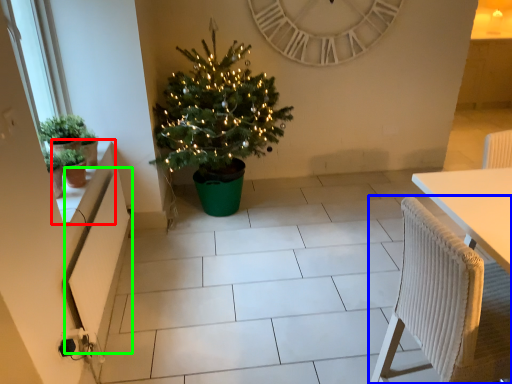
Question: Which object is positioned closest to window sill (highlighted by a red box)? Select from chair (highlighted by a blue box) and radiator (highlighted by a green box).

Choices:
 (A) chair
 (B) radiator

Answer: (B)